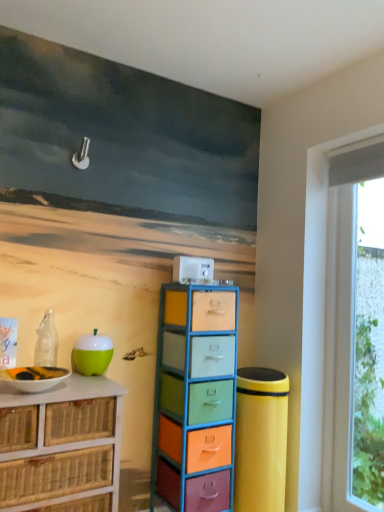
Where is `vacant region under white glossy bowl at lower left (from a real-world perspective)`? This screenshot has width=384, height=512. vacant region under white glossy bowl at lower left (from a real-world perspective) is located at coordinates (27, 393).